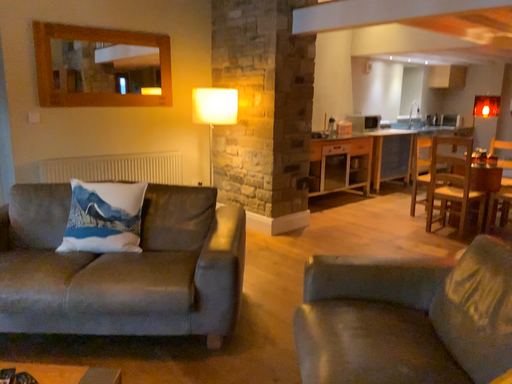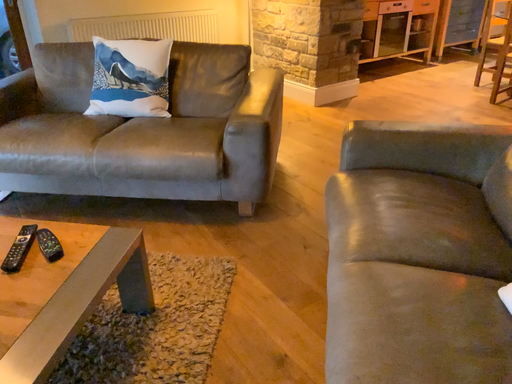
Question: How did the camera likely rotate when shooting the video?

Choices:
 (A) rotated right
 (B) rotated left

Answer: (B)